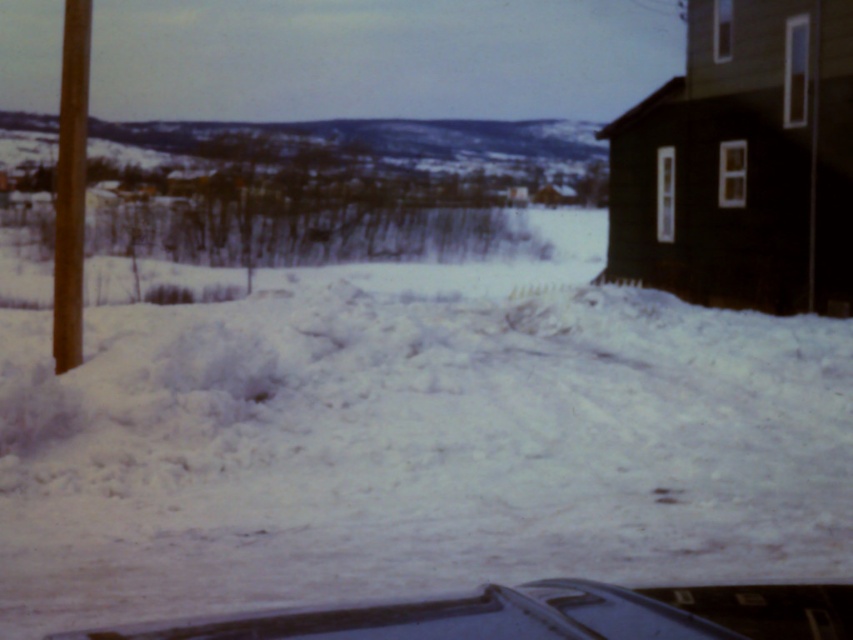
You are driving a car and want to park your vehicle so that the shiny black car at lower center is on your right side. Based on the scene, where should you position the white fluffy snow at center relative to your car?

To have the shiny black car at lower center on your right side, you should position the white fluffy snow at center to the left of your car.

You are a photographer standing in the snow. You want to take a picture of the brown wooden pole at left and the white fluffy snow at center. Which object will appear taller in the photo?

The brown wooden pole at left will appear taller in the photo because it is taller than the white fluffy snow at center.

You are a delivery person trying to park your shiny black car at lower center in front of the house. There is a brown wooden pole at left nearby. Based on their heights, will the car hit the pole when backing up?

The shiny black car at lower center is shorter than the brown wooden pole at left, so the car will hit the pole when backing up because the pole is taller and may obstruct the path.